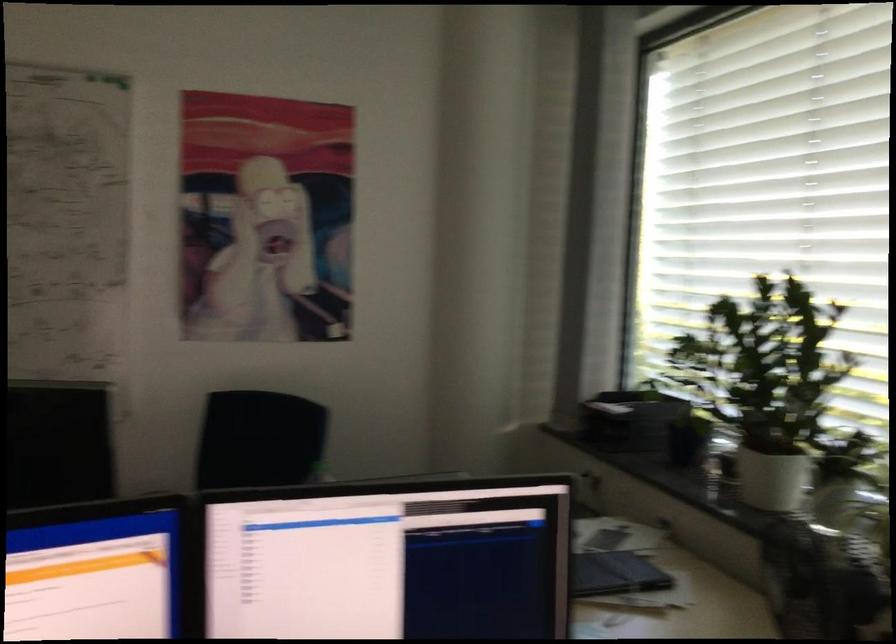
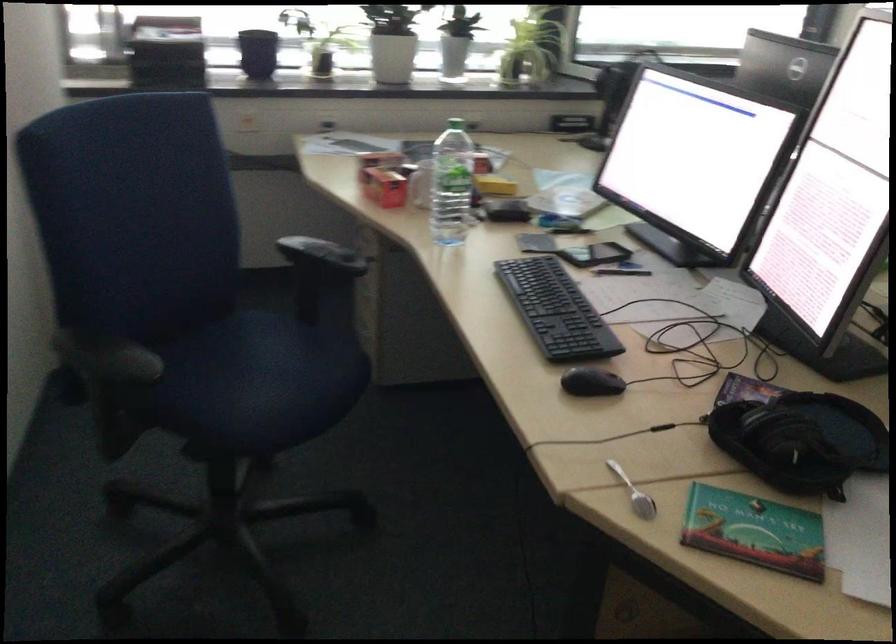
Find the pixel in the second image that matches the point at 714,442 in the first image.

(257, 53)